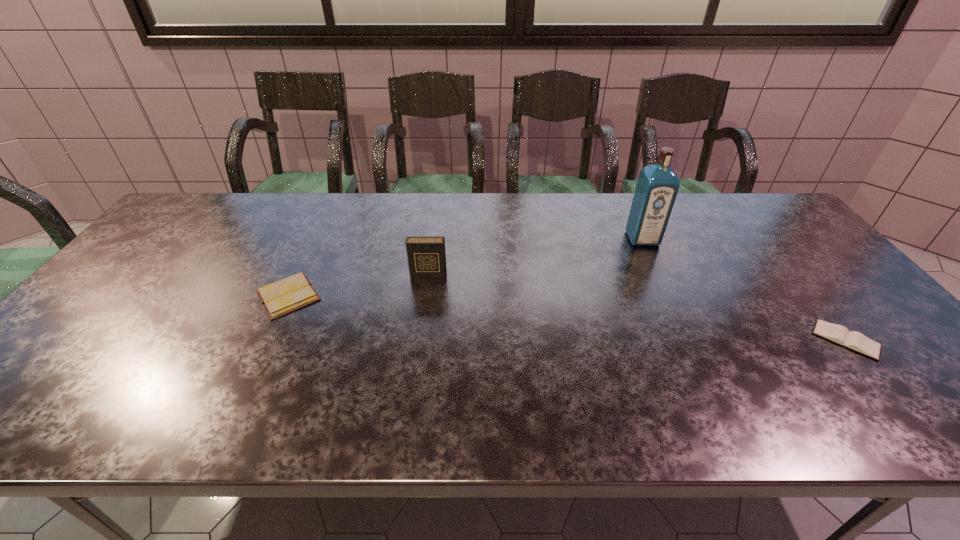
Locate an element on the screen. This screenshot has width=960, height=540. the third closest diary to the farthest object is located at coordinates (286, 295).

Select which diary is the second closest to the tallest diary. Please provide its 2D coordinates. Your answer should be formatted as a tuple, i.e. [(x, y)], where the tuple contains the x and y coordinates of a point satisfying the conditions above.

[(856, 341)]

Where is `free space that satisfies the following two spatial constraints: 1. on the front side of the leftmost diary; 2. on the left side of the rightmost diary`? The width and height of the screenshot is (960, 540). free space that satisfies the following two spatial constraints: 1. on the front side of the leftmost diary; 2. on the left side of the rightmost diary is located at coordinates (267, 340).

Find the location of `vacant space that satisfies the following two spatial constraints: 1. on the front side of the leftmost diary; 2. on the right side of the rightmost object`. vacant space that satisfies the following two spatial constraints: 1. on the front side of the leftmost diary; 2. on the right side of the rightmost object is located at coordinates (267, 340).

You are a GUI agent. You are given a task and a screenshot of the screen. Output one action in this format:
    pyautogui.click(x=<x>, y=<y>)
    Task: Click on the vacant position in the image that satisfies the following two spatial constraints: 1. on the flat label side of the rightmost diary; 2. on the left side of the liquor
    The height and width of the screenshot is (540, 960).
    Given the screenshot: What is the action you would take?
    coord(690,340)

Where is `vacant space that satisfies the following two spatial constraints: 1. on the front cover of the rightmost object; 2. on the right side of the second tallest object`? This screenshot has width=960, height=540. vacant space that satisfies the following two spatial constraints: 1. on the front cover of the rightmost object; 2. on the right side of the second tallest object is located at coordinates (420, 340).

This screenshot has height=540, width=960. Find the location of `vacant space that satisfies the following two spatial constraints: 1. on the front side of the leftmost object; 2. on the right side of the rightmost diary`. vacant space that satisfies the following two spatial constraints: 1. on the front side of the leftmost object; 2. on the right side of the rightmost diary is located at coordinates (267, 340).

At what (x,y) coordinates should I click in order to perform the action: click on vacant area that satisfies the following two spatial constraints: 1. on the front cover of the rightmost diary; 2. on the right side of the second diary from left to right. Please return your answer as a coordinate pair (x, y). Image resolution: width=960 pixels, height=540 pixels. Looking at the image, I should click on (420, 340).

Where is `free space that satisfies the following two spatial constraints: 1. on the front side of the leftmost object; 2. on the left side of the rightmost object`? The height and width of the screenshot is (540, 960). free space that satisfies the following two spatial constraints: 1. on the front side of the leftmost object; 2. on the left side of the rightmost object is located at coordinates (267, 340).